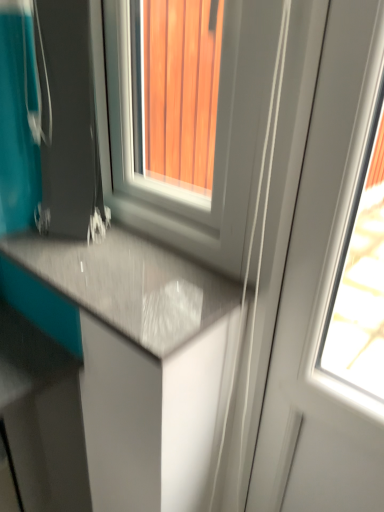
This screenshot has height=512, width=384. Find the location of `vacant region above matte gray countertop at lower left (from a real-world perspective)`. vacant region above matte gray countertop at lower left (from a real-world perspective) is located at coordinates (130, 257).